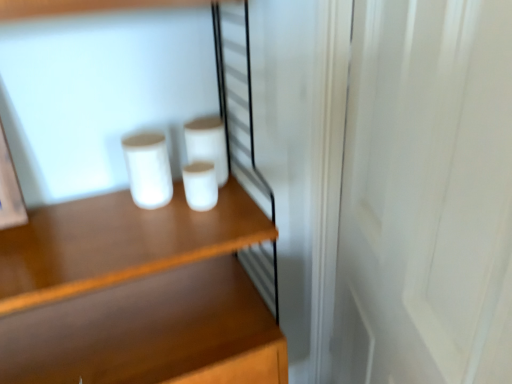
Question: Does white matte cup at center, which appears as the 3th paper towel when viewed from the left, have a greater height compared to white matte paper towel at center, the second paper towel from the left?

Choices:
 (A) no
 (B) yes

Answer: (A)

Question: Is white matte cup at center, which appears as the 3th paper towel when viewed from the left, aimed at white matte paper towel at center, the second paper towel from the left?

Choices:
 (A) no
 (B) yes

Answer: (A)

Question: From a real-world perspective, is white matte cup at center, arranged as the 1th paper towel when viewed from the right, located higher than white matte paper towel at center, positioned as the 2th paper towel in right-to-left order?

Choices:
 (A) yes
 (B) no

Answer: (B)

Question: From the image's perspective, is white matte cup at center, which appears as the 3th paper towel when viewed from the left, under white matte paper towel at center, the second paper towel from the left?

Choices:
 (A) yes
 (B) no

Answer: (A)

Question: Is white matte cup at center, arranged as the 1th paper towel when viewed from the right, to the right of white matte paper towel at center, the second paper towel from the left, from the viewer's perspective?

Choices:
 (A) no
 (B) yes

Answer: (B)

Question: In terms of width, does white matte cup at center, acting as the 1th paper towel starting from the left, look wider or thinner when compared to white wood screen door at right?

Choices:
 (A) wide
 (B) thin

Answer: (B)

Question: In the image, is white matte cup at center, the 3th paper towel positioned from the right, on the left side or the right side of white wood screen door at right?

Choices:
 (A) right
 (B) left

Answer: (B)

Question: From a real-world perspective, is white matte cup at center, acting as the 1th paper towel starting from the left, physically located above or below white wood screen door at right?

Choices:
 (A) below
 (B) above

Answer: (B)

Question: Considering the positions of white matte cup at center, the 3th paper towel positioned from the right, and white wood screen door at right in the image, is white matte cup at center, the 3th paper towel positioned from the right, taller or shorter than white wood screen door at right?

Choices:
 (A) tall
 (B) short

Answer: (B)

Question: Is white matte cup at center, arranged as the 1th paper towel when viewed from the right, in front of or behind wooden shelf at center in the image?

Choices:
 (A) front
 (B) behind

Answer: (B)

Question: In terms of width, does white matte cup at center, which appears as the 3th paper towel when viewed from the left, look wider or thinner when compared to wooden shelf at center?

Choices:
 (A) wide
 (B) thin

Answer: (A)

Question: Considering the positions of white matte cup at center, which appears as the 3th paper towel when viewed from the left, and wooden shelf at center in the image, is white matte cup at center, which appears as the 3th paper towel when viewed from the left, taller or shorter than wooden shelf at center?

Choices:
 (A) short
 (B) tall

Answer: (A)

Question: Does point (189, 168) appear closer or farther from the camera than point (228, 253)?

Choices:
 (A) closer
 (B) farther

Answer: (A)

Question: From a real-world perspective, relative to white matte cup at center, the 3th paper towel positioned from the right, is white matte cup at center, arranged as the 1th paper towel when viewed from the right, vertically above or below?

Choices:
 (A) below
 (B) above

Answer: (A)

Question: In terms of size, does white matte cup at center, arranged as the 1th paper towel when viewed from the right, appear bigger or smaller than white matte cup at center, the 3th paper towel positioned from the right?

Choices:
 (A) big
 (B) small

Answer: (B)